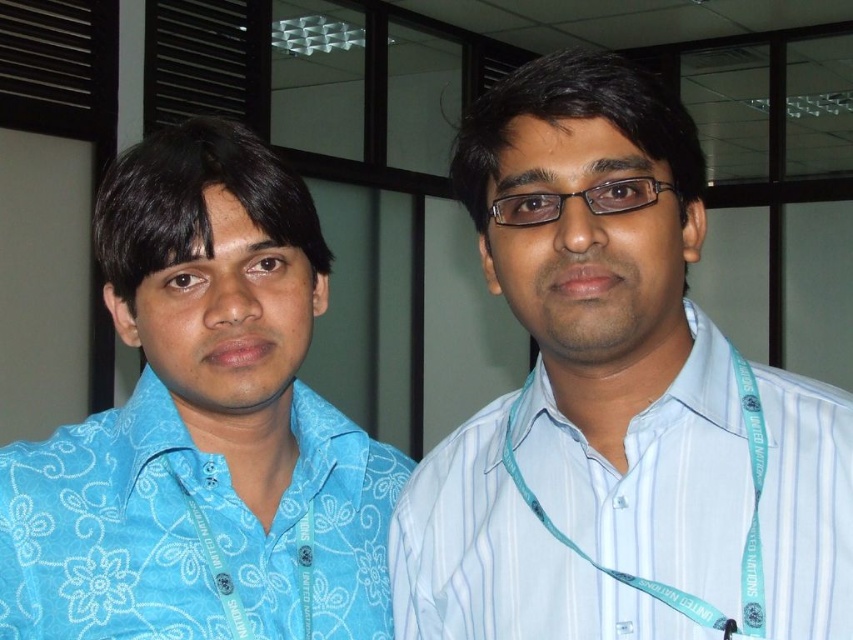
Is point (199, 218) less distant than point (561, 416)?

No, it is behind (561, 416).

Where is `blue floral shirt at left`? Image resolution: width=853 pixels, height=640 pixels. blue floral shirt at left is located at coordinates [202, 424].

Identify the location of blue floral shirt at left. (202, 424).